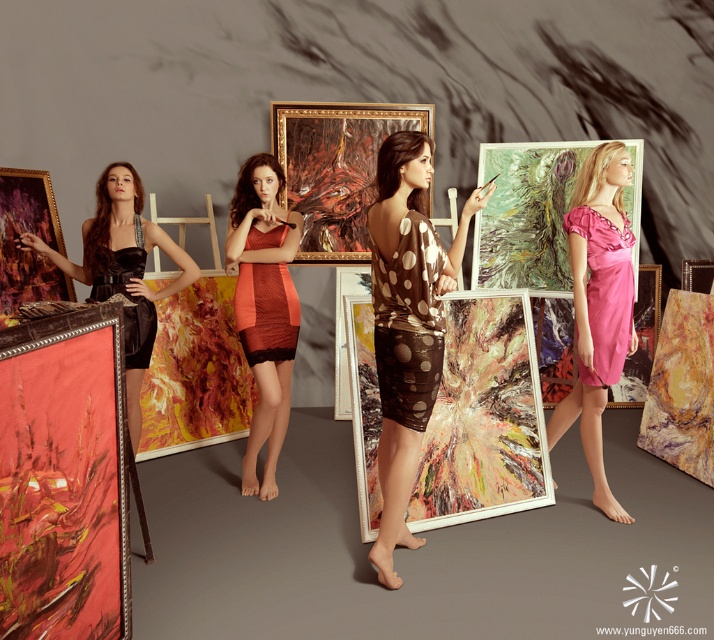
Between orange lace dress at center and velvet black dress at left, which one appears on the left side from the viewer's perspective?

Positioned to the left is velvet black dress at left.

Identify the location of orange lace dress at center. Image resolution: width=714 pixels, height=640 pixels. click(x=263, y=307).

The width and height of the screenshot is (714, 640). In order to click on orange lace dress at center in this screenshot , I will do `click(263, 307)`.

Who is lower down, orange lace dress at center or velvet dress at left?

orange lace dress at center is lower down.

Can you confirm if orange lace dress at center is smaller than velvet dress at left?

Yes, orange lace dress at center is smaller than velvet dress at left.

This screenshot has height=640, width=714. Identify the location of orange lace dress at center. (263, 307).

Find the location of `orange lace dress at center`. orange lace dress at center is located at coordinates (263, 307).

Measure the distance between brown shiny dress at center and shiny gold frame at left.

They are 6.61 feet apart.

Which is above, brown shiny dress at center or shiny gold frame at left?

shiny gold frame at left is higher up.

Which is in front, point (402, 221) or point (29, 260)?

Point (402, 221) is more forward.

You are a GUI agent. You are given a task and a screenshot of the screen. Output one action in this format:
    pyautogui.click(x=<x>, y=<y>)
    Task: Click on the brown shiny dress at center
    
    Given the screenshot: What is the action you would take?
    pyautogui.click(x=407, y=323)